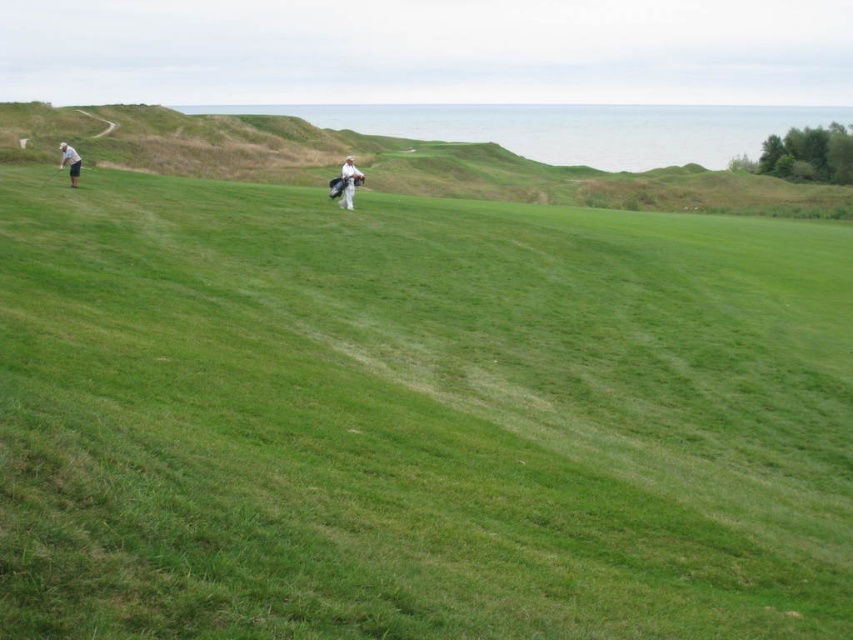
You are a golfer preparing to hit a ball from the green grassy hillside at upper left. You notice the white matte golf club at left nearby. Which object is wider in this scene?

The green grassy hillside at upper left might be wider than the white matte golf club at left.

You are standing at the point marked as point (x=387, y=161) on a golf course. What is the terrain like under your feet?

The terrain under your feet at point (x=387, y=161) is a green grassy hillside at upper left.

You are standing at point (347,157) on the golf course. You want to walk to the nearest golf cart station located at the point that is 45.59 meters away from you. Which direction should you walk to reach the golf cart station?

You should walk towards the direction of the golf cart station located 45.59 meters away from your current position at point (347,157).